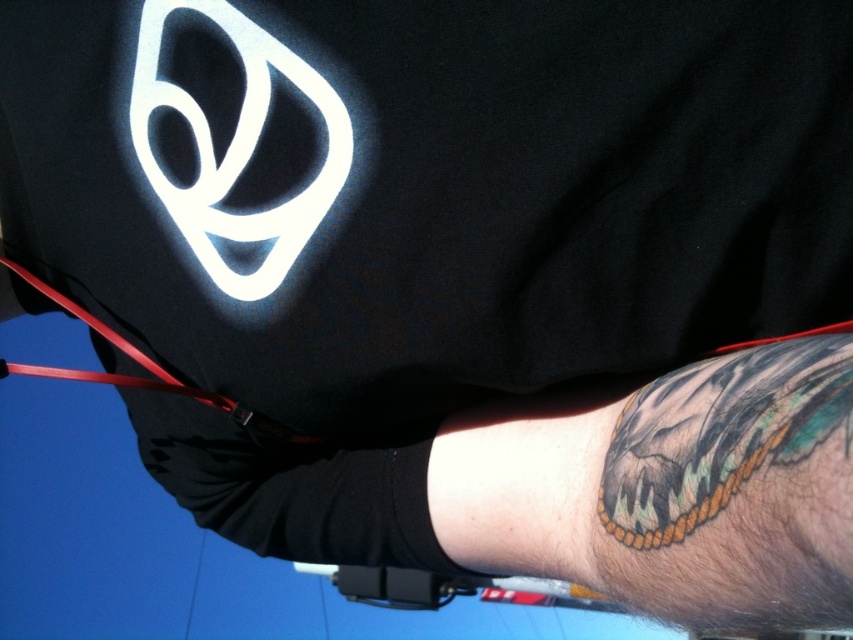
Measure the distance between black matte shirt at center and camera.

They are 28.39 centimeters apart.

Is black matte shirt at center to the left of multicolored ink butterfly at lower right from the viewer's perspective?

Indeed, black matte shirt at center is positioned on the left side of multicolored ink butterfly at lower right.

Who is more forward, (799,346) or (633,536)?

Point (799,346) is more forward.

Identify the location of black matte shirt at center. (415, 218).

Which is more to the right, multicolored ink butterfly at lower right or rubber strap at lower left?

From the viewer's perspective, multicolored ink butterfly at lower right appears more on the right side.

Where is `multicolored ink butterfly at lower right`? The height and width of the screenshot is (640, 853). multicolored ink butterfly at lower right is located at coordinates (720, 433).

Is black matte shirt at center above black tattooed skin at lower right?

Correct, black matte shirt at center is located above black tattooed skin at lower right.

What do you see at coordinates (415, 218) in the screenshot? I see `black matte shirt at center` at bounding box center [415, 218].

The width and height of the screenshot is (853, 640). What are the coordinates of `black matte shirt at center` in the screenshot? It's located at (415, 218).